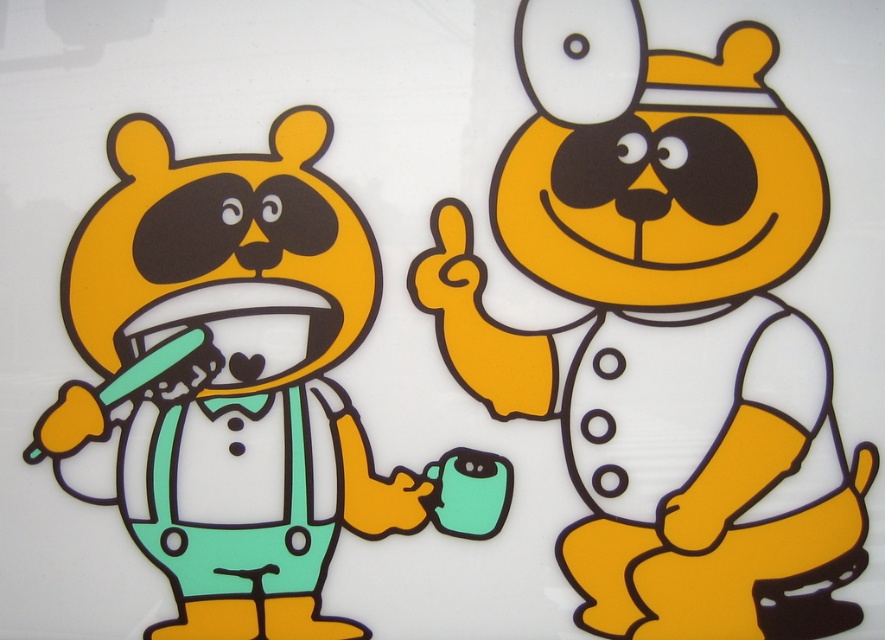
You are a photographer standing 1.5 meters away from the camera. You want to take a photo of the matte plastic bear at center. Will you be able to capture the entire bear in the photo without moving closer or farther away?

The matte plastic bear at center and camera are 1.67 meters apart. Since you are standing 1.5 meters away from the camera, the total distance between you and the bear would be 1.5 meters plus 1.67 meters, totaling 3.17 meters. Whether you can capture the entire bear depends on your camera lens. A standard lens with a 50mm focal length can capture a subject about 1.5 meters tall at this distance. If the bear is smaller, say around 1 meter tall, then yes, you can capture it fully. However, if it is larger, a

You are a dentist examining a cartoon scene where a matte plastic bear at center and a matte green toothbrush at left are present. Based on their positions, which object is located to the right side of the other?

The matte plastic bear at center is to the right of the matte green toothbrush at left according to the description.

You are standing in front of the two cartoon bears. The first bear is brushing its teeth with a cup and toothbrush, looking surprised. The second bear is pointing upwards and smiling cheerfully. There are two points marked in the image. The first point is at coordinates point (781,156) and the second point is at coordinates point (159,403). Which point is closer to you?

Point (781,156) is in front of point (159,403), so the first point is closer to you.